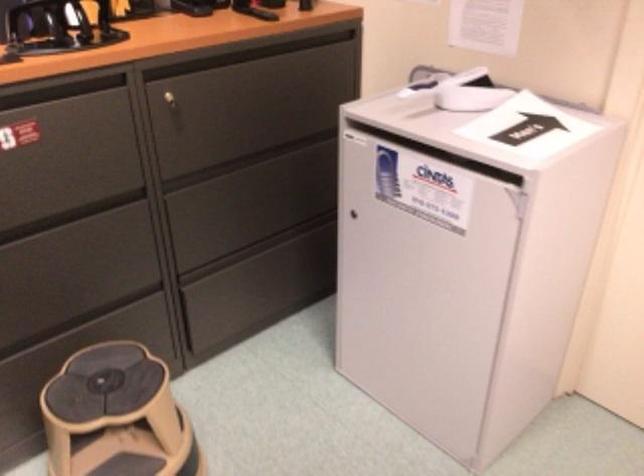
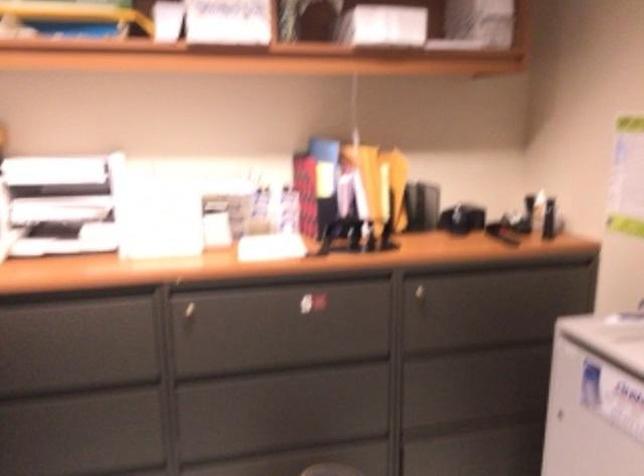
In the second image, find the point that corresponds to [258,112] in the first image.

(489, 311)